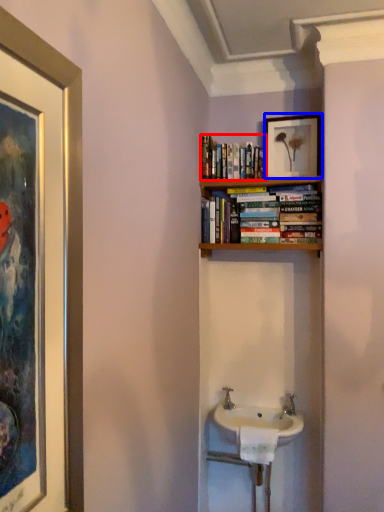
Question: Which object appears closest to the camera in this image, book (highlighted by a red box) or picture frame (highlighted by a blue box)?

Choices:
 (A) book
 (B) picture frame

Answer: (A)